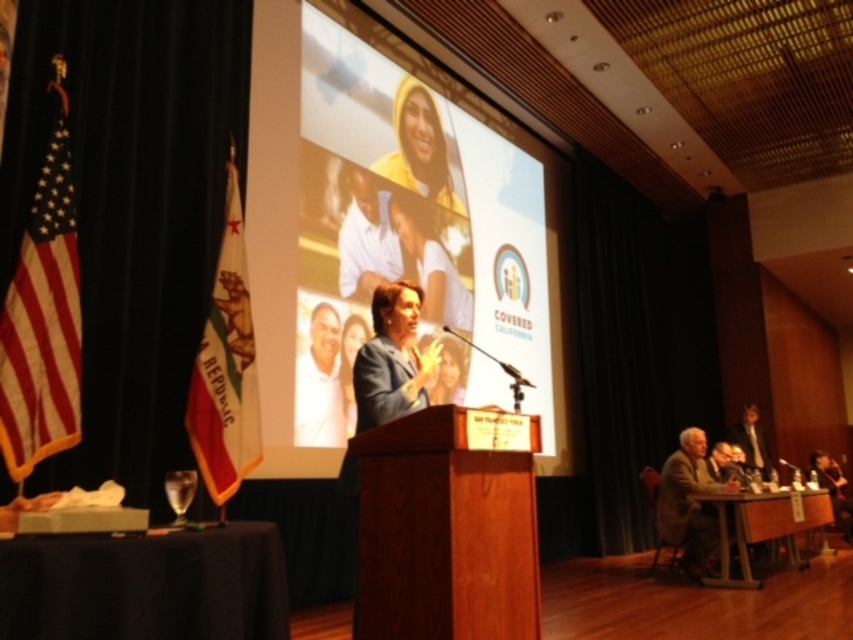
Looking at this image, you are an event planner organizing a photoshoot for the conference. The photographer wants to capture both the matte blue suit at center and the gray fabric suit at lower right in the same frame. Which suit is closer to the camera?

The matte blue suit at center is closer to the camera since it is positioned over the gray fabric suit at lower right, indicating it is in front.

You are an attendee at the event and want to know if your 18 inch wide bag can fit between the white matte shirt at center and the light brown wooden chair at lower right. Can it fit?

The white matte shirt at center has a lesser width compared to light brown wooden chair at lower right. Therefore, the space between them is at least 18 inches, so your bag can fit.